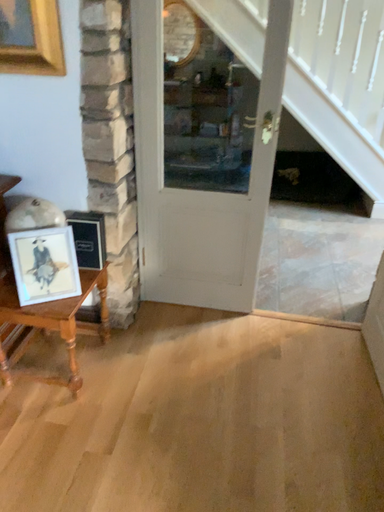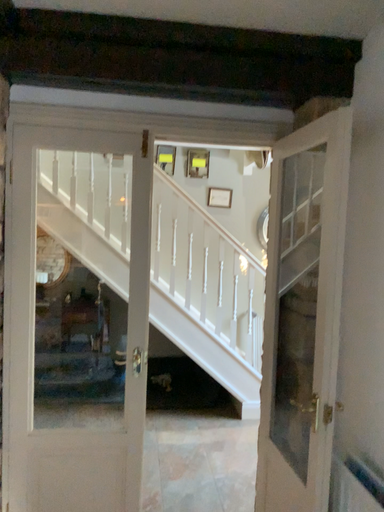
Question: Which way did the camera rotate in the video?

Choices:
 (A) rotated left
 (B) rotated right

Answer: (B)